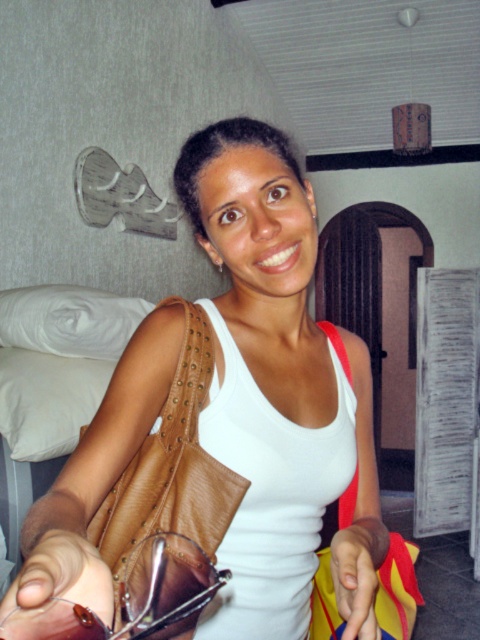
Question: Which object is positioned closest to the leather at left?

Choices:
 (A) smooth yellow fabric at lower center
 (B) matte brown purse at center

Answer: (B)

Question: Which point appears farthest from the camera in this image?

Choices:
 (A) (12, 586)
 (B) (184, 369)
 (C) (205, 624)
 (D) (344, 630)

Answer: (B)

Question: From the image, what is the correct spatial relationship of leather at left in relation to smooth yellow fabric at lower center?

Choices:
 (A) left
 (B) right

Answer: (A)

Question: Can you confirm if matte brown purse at center is positioned above leather at left?

Choices:
 (A) no
 (B) yes

Answer: (B)

Question: Which object is the closest to the leather at left?

Choices:
 (A) matte brown purse at center
 (B) smooth yellow fabric at lower center
 (C) leather glasses at lower left

Answer: (A)

Question: Is matte brown purse at center to the right of leather at left from the viewer's perspective?

Choices:
 (A) no
 (B) yes

Answer: (B)